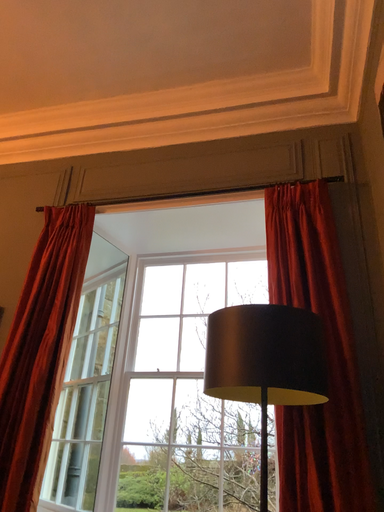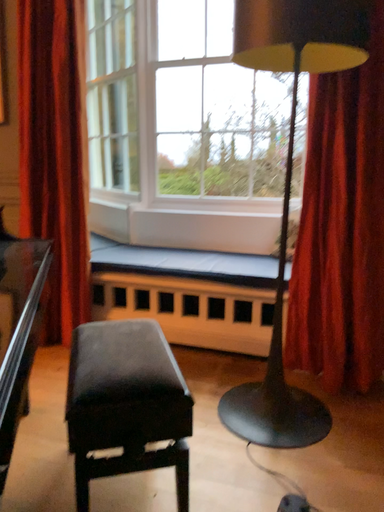
Question: Which way did the camera rotate in the video?

Choices:
 (A) rotated upward
 (B) rotated downward

Answer: (B)